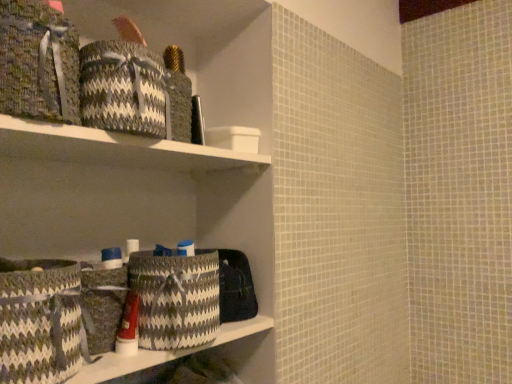
Question: From the image's perspective, is white matte shelf at upper center positioned above or below textured woven basket at lower left, the second basket in the front-to-back sequence?

Choices:
 (A) above
 (B) below

Answer: (A)

Question: Looking at their shapes, would you say white matte shelf at upper center is wider or thinner than textured woven basket at lower left, the second basket in the front-to-back sequence?

Choices:
 (A) thin
 (B) wide

Answer: (B)

Question: Estimate the real-world distances between objects in this image. Which object is farther from the textured woven basket at lower left, positioned as the 1th basket in back-to-front order?

Choices:
 (A) textured woven laundry basket at center
 (B) textured woven basket at lower left
 (C) black and white woven basket at upper left, which ranks as the first material in right-to-left order
 (D) white matte shelf at upper center
 (E) matte plastic tube at center

Answer: (C)

Question: Based on their relative distances, which object is farther from the black and white woven basket at upper left, which ranks as the first material in right-to-left order?

Choices:
 (A) textured woven laundry basket at center
 (B) white matte shelf at upper center
 (C) textured woven basket at lower left
 (D) textured woven basket at lower left, the second basket in the front-to-back sequence
 (E) woven fabric basket at upper left, acting as the 2th material starting from the right

Answer: (C)